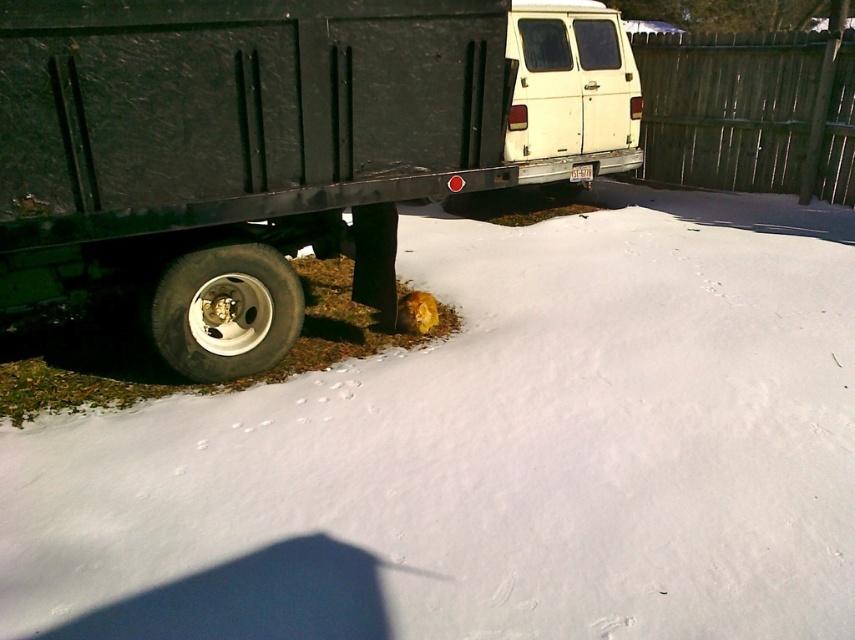
Question: Is white fluffy snow at lower center positioned at the back of white matte van at upper center?

Choices:
 (A) no
 (B) yes

Answer: (A)

Question: In this image, where is matte black truck at lower left located relative to white matte van at upper center?

Choices:
 (A) below
 (B) above

Answer: (A)

Question: Which of these objects is positioned farthest from the black rubber tire at lower left?

Choices:
 (A) wooden fence at upper right
 (B) matte black truck at lower left
 (C) white fluffy snow at lower center

Answer: (A)

Question: Which object appears farthest from the camera in this image?

Choices:
 (A) white matte van at upper center
 (B) black rubber tire at lower left
 (C) matte black truck at lower left
 (D) wooden fence at upper right

Answer: (D)

Question: Among these objects, which one is nearest to the camera?

Choices:
 (A) black rubber tire at lower left
 (B) matte black truck at lower left
 (C) wooden fence at upper right

Answer: (B)

Question: Is matte black truck at lower left positioned in front of wooden fence at upper right?

Choices:
 (A) no
 (B) yes

Answer: (B)